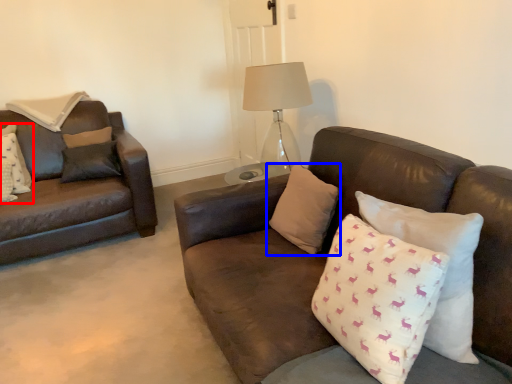
Question: Among these objects, which one is nearest to the camera, pillow (highlighted by a red box) or pillow (highlighted by a blue box)?

Choices:
 (A) pillow
 (B) pillow

Answer: (B)